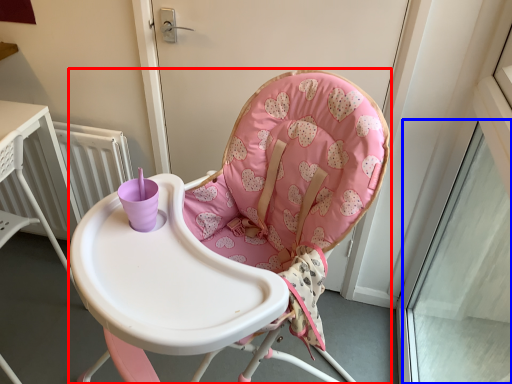
Question: Which object is closer to the camera taking this photo, chair (highlighted by a red box) or window (highlighted by a blue box)?

Choices:
 (A) chair
 (B) window

Answer: (A)